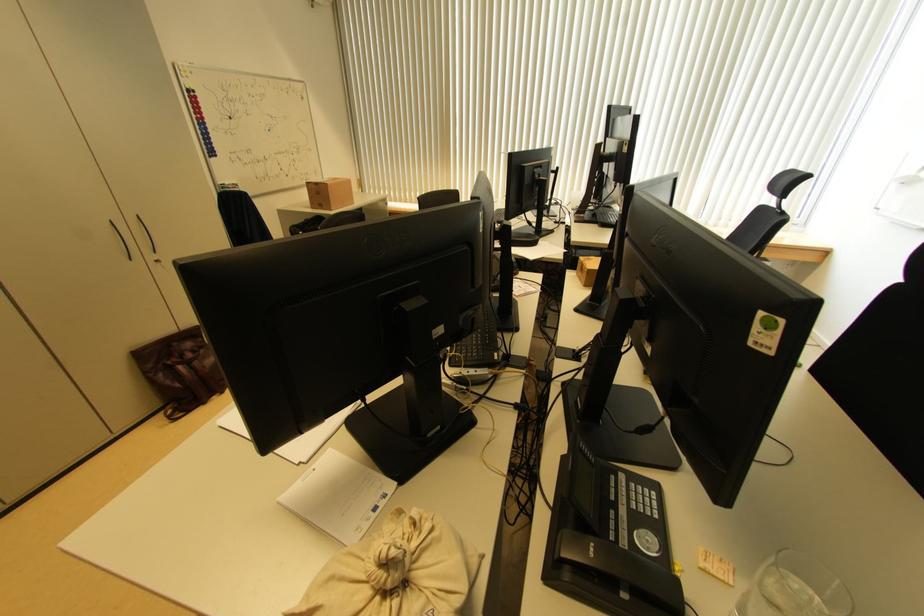
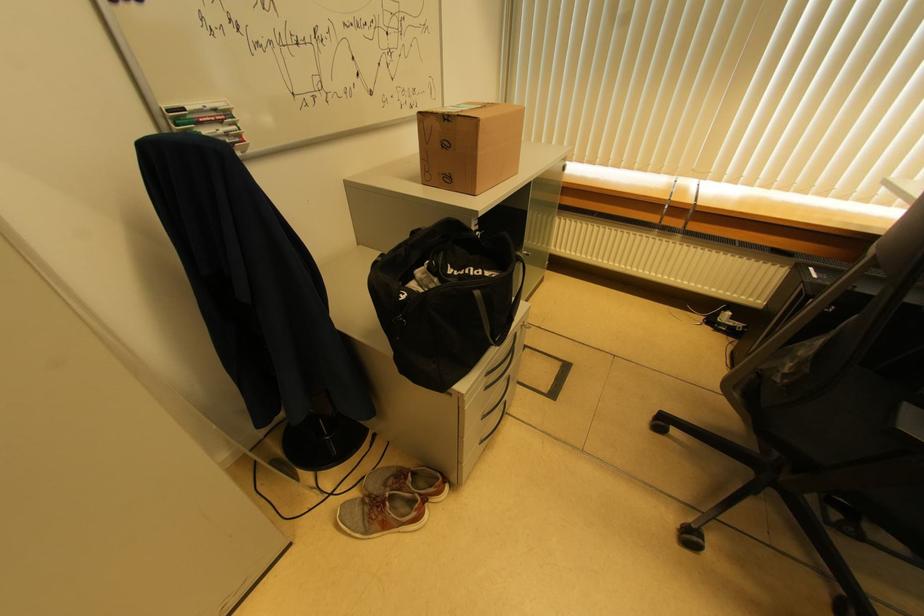
In the second image, find the point that corresponds to (x=231, y=191) in the first image.

(201, 126)